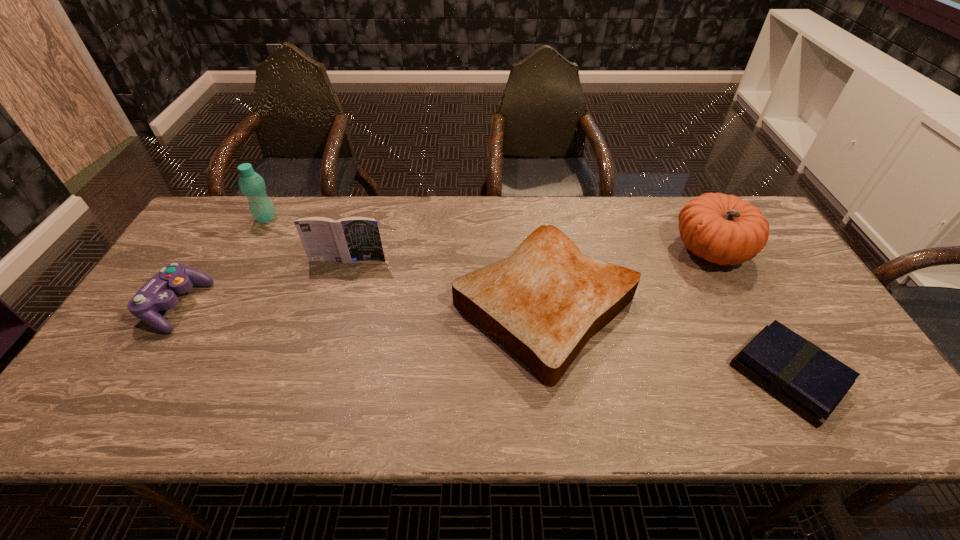
Where is `free space between the bread and the nearer book`? The height and width of the screenshot is (540, 960). free space between the bread and the nearer book is located at coordinates (666, 341).

The width and height of the screenshot is (960, 540). I want to click on vacant area between the shortest object and the bread, so click(x=666, y=341).

Where is `vacant space that's between the fourth object from right to left and the bread`? vacant space that's between the fourth object from right to left and the bread is located at coordinates (446, 283).

The height and width of the screenshot is (540, 960). In order to click on vacant space in between the tallest object and the leftmost object in this screenshot , I will do `click(222, 262)`.

The height and width of the screenshot is (540, 960). Find the location of `free space between the bread and the bottle`. free space between the bread and the bottle is located at coordinates (406, 262).

Find the location of a particular element. This screenshot has height=540, width=960. vacant space in between the pumpkin and the leftmost object is located at coordinates (444, 278).

Where is `blank region between the tallest object and the leftmost object`? The height and width of the screenshot is (540, 960). blank region between the tallest object and the leftmost object is located at coordinates (222, 262).

Identify which object is the fifth closest to the tallest object. Please provide its 2D coordinates. Your answer should be formatted as a tuple, i.e. [(x, y)], where the tuple contains the x and y coordinates of a point satisfying the conditions above.

[(800, 374)]

The image size is (960, 540). Find the location of `object that is the third nearest to the right book`. object that is the third nearest to the right book is located at coordinates (346, 240).

Identify the location of free spot that satisfies the following two spatial constraints: 1. on the front cover of the fourth object from right to left; 2. on the right side of the bread. The width and height of the screenshot is (960, 540). (334, 306).